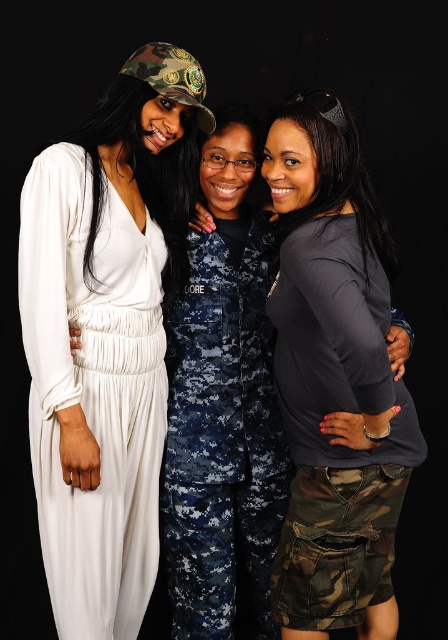
Question: From the image, what is the correct spatial relationship of dark gray matte shirt at center in relation to white silky dress at left?

Choices:
 (A) right
 (B) left

Answer: (A)

Question: Does dark gray matte shirt at center have a lesser width compared to white silky dress at left?

Choices:
 (A) no
 (B) yes

Answer: (A)

Question: Which point is closer to the camera taking this photo?

Choices:
 (A) (341, 349)
 (B) (69, 372)

Answer: (A)

Question: Which object appears closest to the camera in this image?

Choices:
 (A) white silky dress at left
 (B) dark gray matte shirt at center

Answer: (B)

Question: Is dark gray matte shirt at center wider than white silky dress at left?

Choices:
 (A) no
 (B) yes

Answer: (B)

Question: Among these points, which one is farthest from the camera?

Choices:
 (A) (116, 509)
 (B) (383, 486)

Answer: (A)